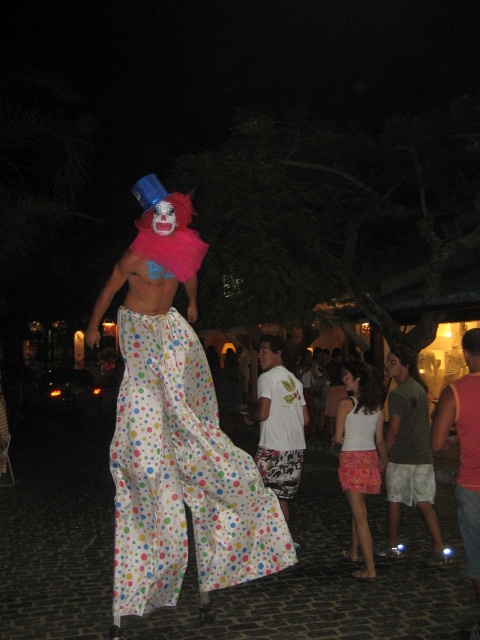
Which is below, white tank top at center or white polka dot pants at center?

Positioned lower is white tank top at center.

Can you confirm if white tank top at center is thinner than white polka dot pants at center?

Incorrect, white tank top at center's width is not less than white polka dot pants at center's.

Where is `white tank top at center`? white tank top at center is located at coordinates (360, 454).

Can you confirm if white tank top at center is bigger than pink fabric skirt at lower center?

Yes, white tank top at center is bigger than pink fabric skirt at lower center.

Who is taller, white tank top at center or pink fabric skirt at lower center?

white tank top at center is taller.

Who is more distant from viewer, (x=351, y=412) or (x=369, y=451)?

Point (x=369, y=451)

Identify the location of white tank top at center. (360, 454).

Looking at this image, who is more forward, (x=374, y=456) or (x=283, y=401)?

Point (x=374, y=456) is in front.

Can you confirm if white tank top at center is positioned to the left of white printed t-shirt at center?

In fact, white tank top at center is to the right of white printed t-shirt at center.

Measure the distance between point (372, 426) and camera.

They are 5.85 meters apart.

Find the location of `white tank top at center`. white tank top at center is located at coordinates (360, 454).